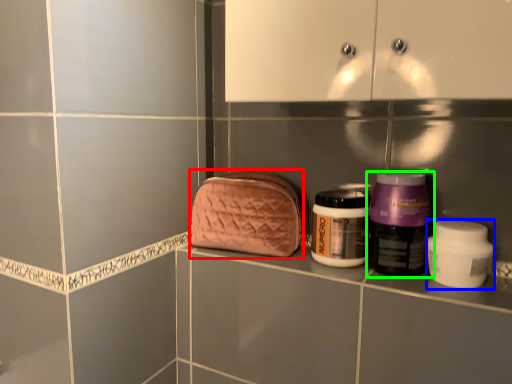
Question: Estimate the real-world distances between objects in this image. Which object is closer to pouch (highlighted by a red box), product (highlighted by a blue box) or bottle (highlighted by a green box)?

Choices:
 (A) product
 (B) bottle

Answer: (B)